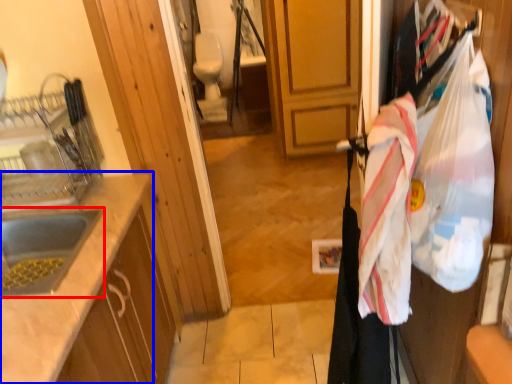
Question: Which of the following is the farthest to the observer, sink (highlighted by a red box) or countertop (highlighted by a blue box)?

Choices:
 (A) sink
 (B) countertop

Answer: (A)